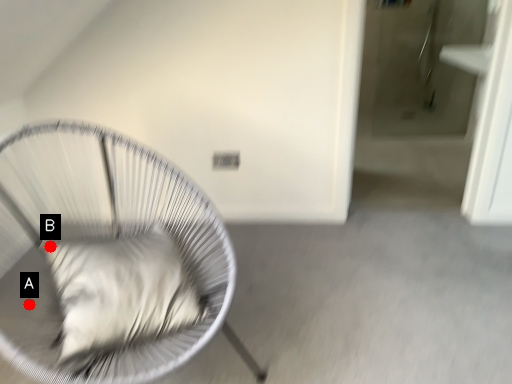
Question: Two points are circled on the image, labeled by A and B beside each circle. Which point is farther from the camera taking this photo?

Choices:
 (A) A is further
 (B) B is further

Answer: (B)